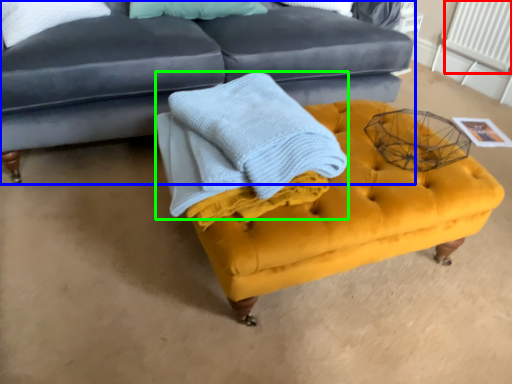
Question: Which object is the closest to the radiator (highlighted by a red box)? Choose among these: studio couch (highlighted by a blue box) or blanket (highlighted by a green box).

Choices:
 (A) studio couch
 (B) blanket

Answer: (A)